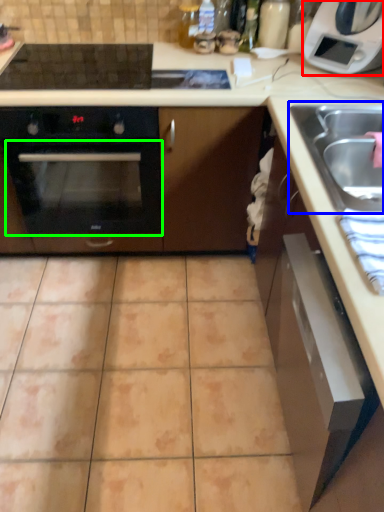
Question: Which object is positioned closest to home appliance (highlighted by a red box)? Select from sink (highlighted by a blue box) and oven (highlighted by a green box).

Choices:
 (A) sink
 (B) oven

Answer: (A)